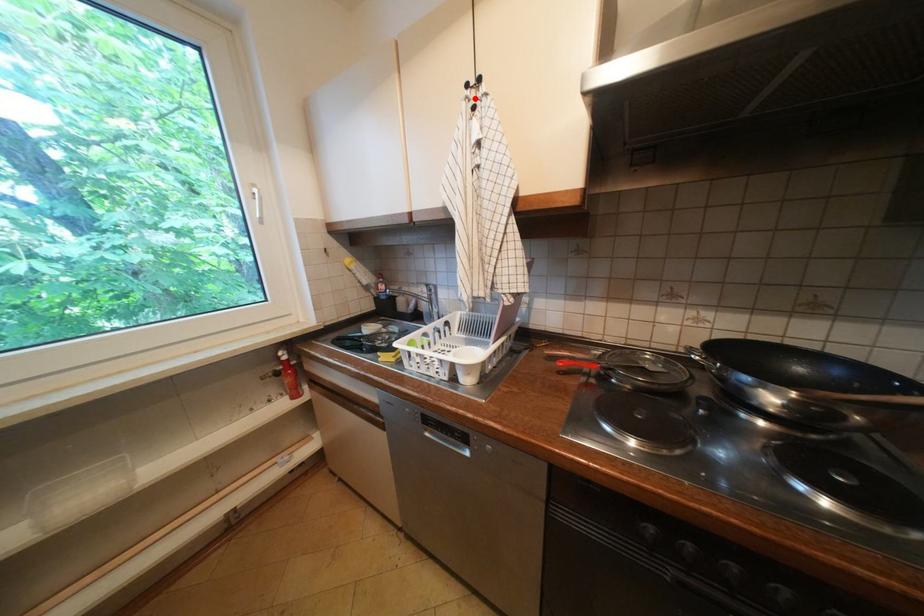
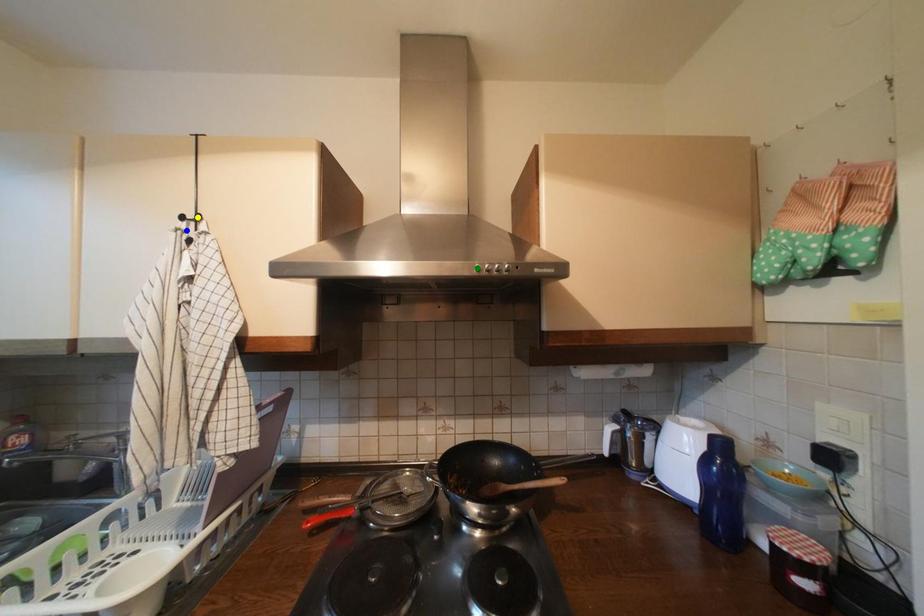
Question: I am providing you with two images of the same scene from different viewpoints. A red point is marked on the first image. You are given multiple points on the second image. Which point in image 2 is actually the same real-world point as the red point in image 1?

Choices:
 (A) blue point
 (B) yellow point
 (C) green point

Answer: (A)